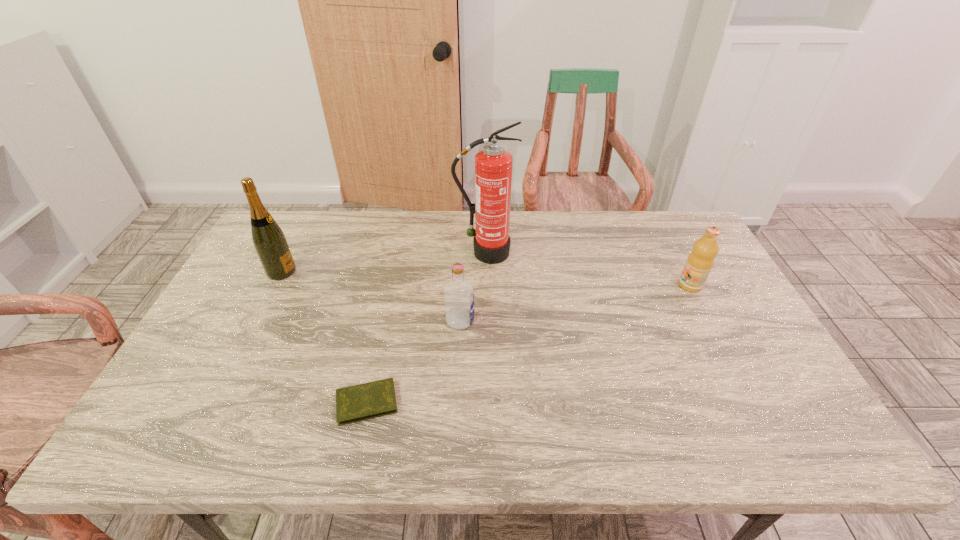
Find the location of a particular element. This screenshot has width=960, height=540. free space at the left edge is located at coordinates (255, 319).

Where is `vacant space at the right edge of the desktop`? vacant space at the right edge of the desktop is located at coordinates (717, 274).

The image size is (960, 540). Identify the location of vacant area at the far right corner of the desktop. (646, 212).

Where is `vacant area that lies between the vodka and the wine bottle`? vacant area that lies between the vodka and the wine bottle is located at coordinates (371, 296).

Locate an element on the screen. vacant area that lies between the nearest object and the fruit juice is located at coordinates (529, 344).

Locate an element on the screen. Image resolution: width=960 pixels, height=540 pixels. free area in between the second tallest object and the vodka is located at coordinates (371, 296).

Locate an element on the screen. This screenshot has width=960, height=540. empty space that is in between the fruit juice and the tallest object is located at coordinates (588, 269).

I want to click on free space between the leftmost object and the fire extinguisher, so click(x=383, y=262).

The height and width of the screenshot is (540, 960). What are the coordinates of `free space that is in between the tallest object and the diary` in the screenshot? It's located at (426, 328).

This screenshot has height=540, width=960. Identify the location of free area in between the wine bottle and the fruit juice. (486, 279).